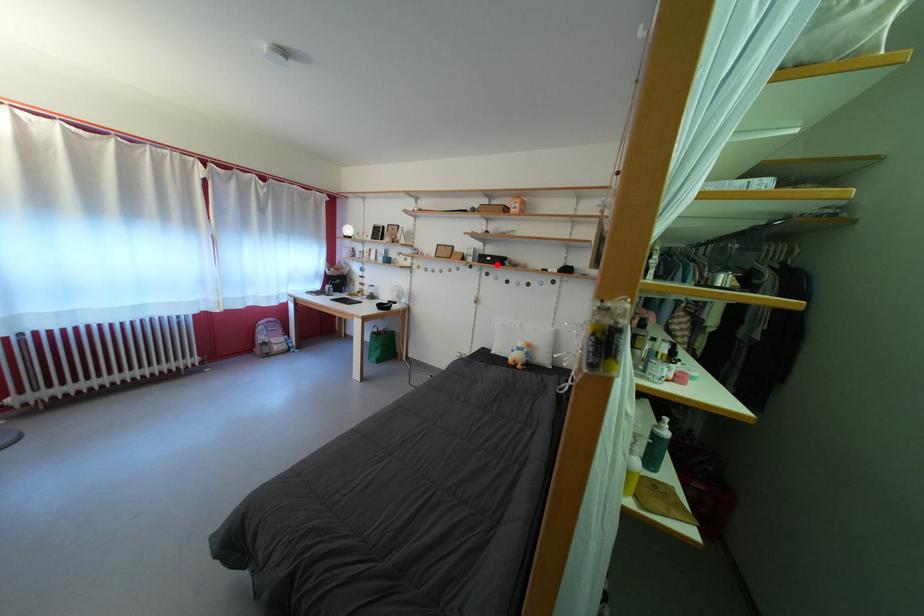
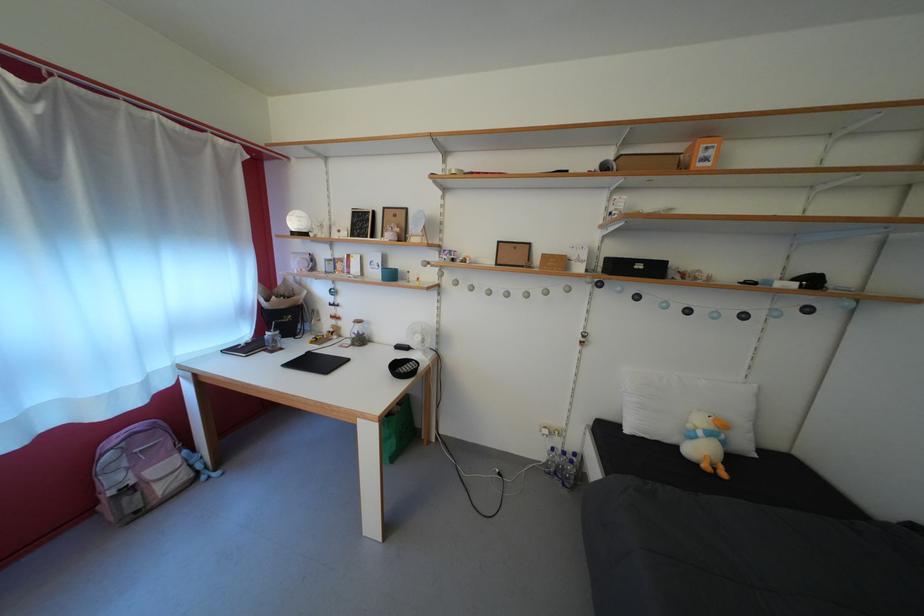
In the second image, find the point that corresponds to the highlighted location in the first image.

(648, 273)